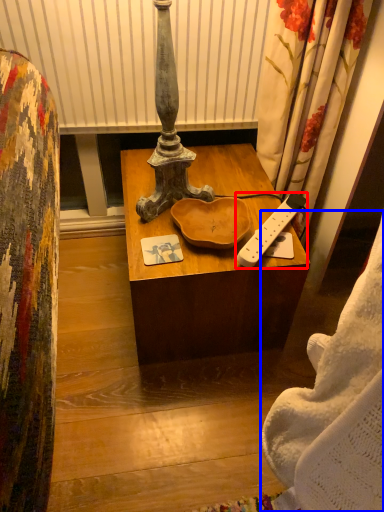
Question: Among these objects, which one is nearest to the camera, remote control (highlighted by a red box) or blanket (highlighted by a blue box)?

Choices:
 (A) remote control
 (B) blanket

Answer: (B)